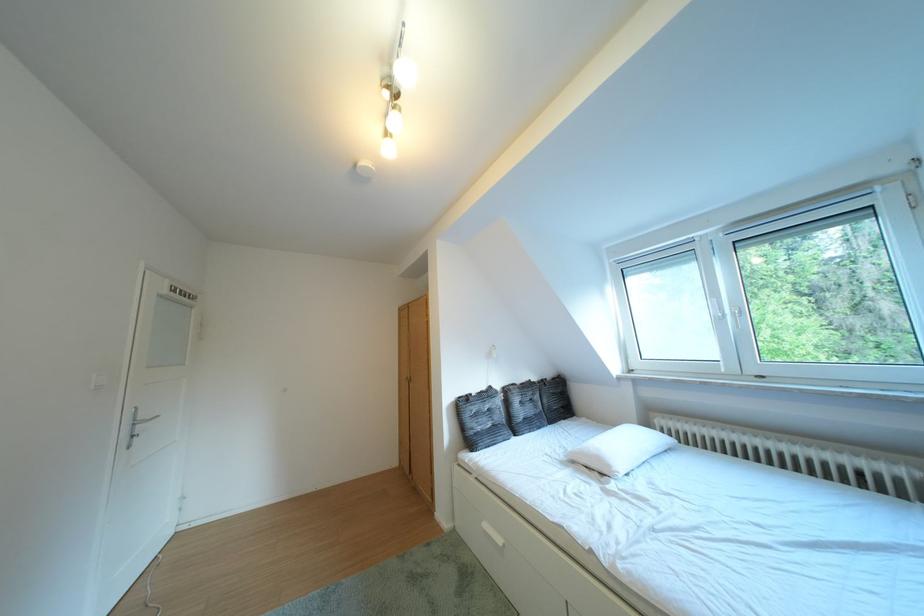
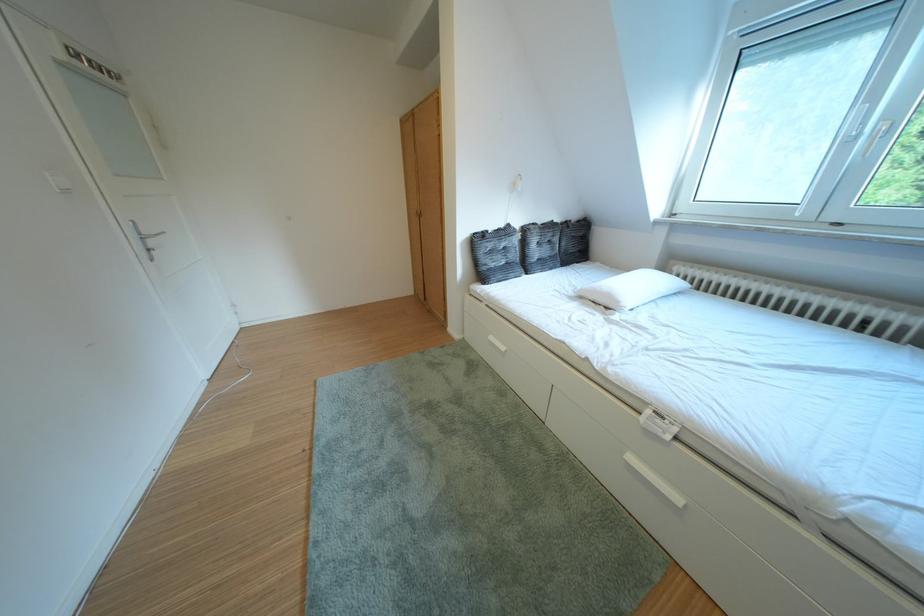
Where in the second image is the point corresponding to point 484,400 from the first image?

(500, 237)